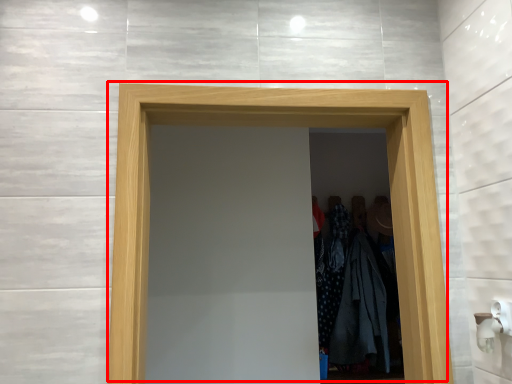
Question: From the image's perspective, what is the correct spatial relationship of door (annotated by the red box) in relation to clothing?

Choices:
 (A) below
 (B) above

Answer: (B)